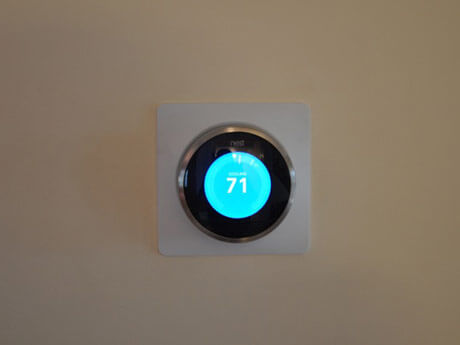
This screenshot has height=345, width=460. What are the coordinates of `empty space on wall to the right of wall` in the screenshot? It's located at (373, 191).